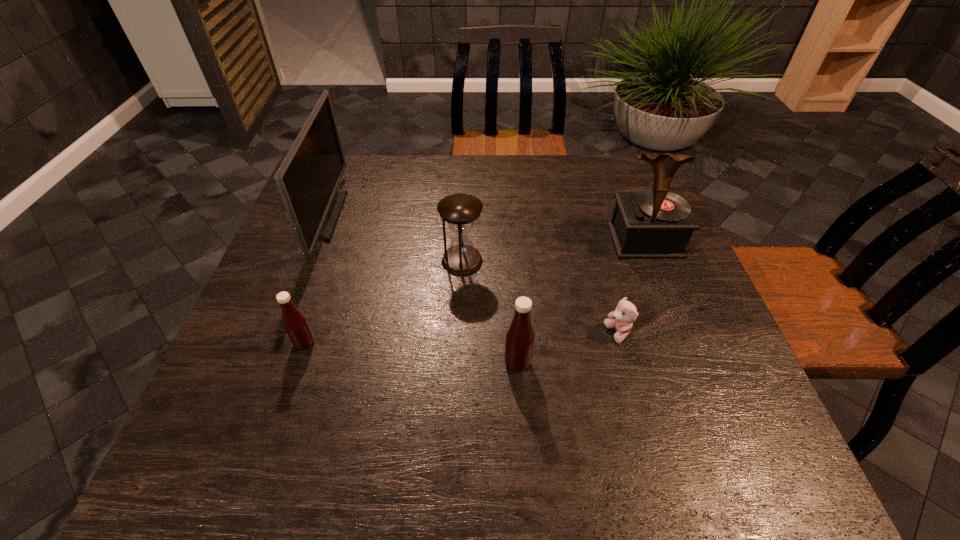
At what (x,y) coordinates should I click in order to perform the action: click on the farther Tabasco sauce. Please return your answer as a coordinate pair (x, y). The width and height of the screenshot is (960, 540). Looking at the image, I should click on (294, 322).

Where is `the left Tabasco sauce`? Image resolution: width=960 pixels, height=540 pixels. the left Tabasco sauce is located at coordinates (294, 322).

This screenshot has height=540, width=960. Identify the location of the nearest object. (519, 341).

The width and height of the screenshot is (960, 540). Identify the location of the nearer Tabasco sauce. (519, 341).

This screenshot has height=540, width=960. I want to click on hourglass, so click(x=460, y=210).

Find the location of a particular element. This screenshot has height=540, width=960. monitor is located at coordinates [308, 178].

This screenshot has height=540, width=960. In order to click on the rightmost object in this screenshot , I will do `click(658, 224)`.

I want to click on the shortest object, so click(621, 319).

The width and height of the screenshot is (960, 540). In order to click on teddy bear in this screenshot , I will do `click(621, 319)`.

You are a GUI agent. You are given a task and a screenshot of the screen. Output one action in this format:
    pyautogui.click(x=<x>, y=<y>)
    Task: Click on the vacant space located 0.300m on the back of the shorter Tabasco sauce
    
    Given the screenshot: What is the action you would take?
    pyautogui.click(x=339, y=241)